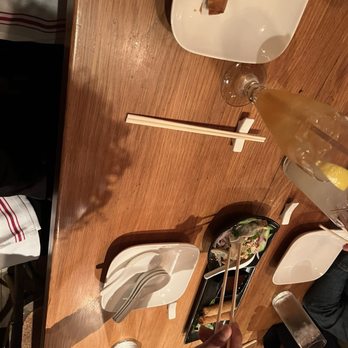
Locate an element on the screen. tray is located at coordinates (210, 290).